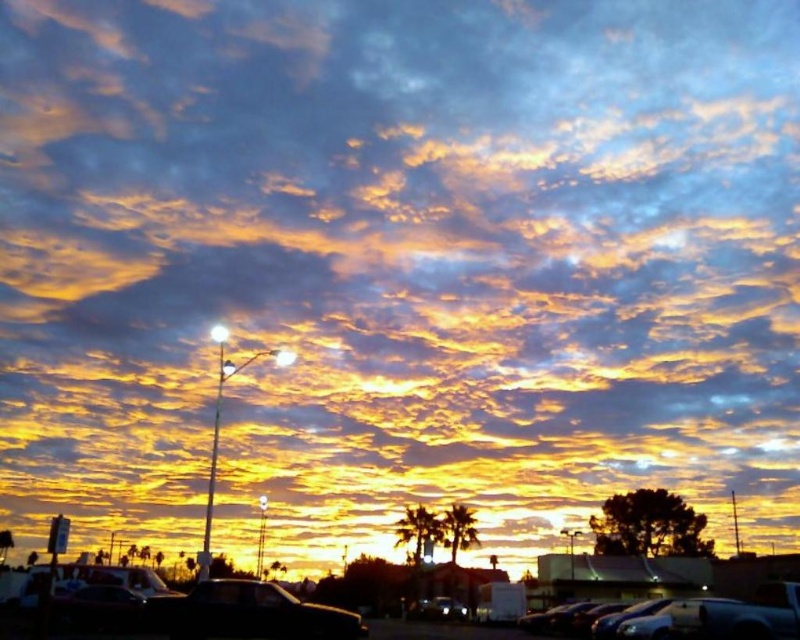
Can you confirm if black glossy car at lower center is positioned to the right of black asphalt parking lot at lower center?

Incorrect, black glossy car at lower center is not on the right side of black asphalt parking lot at lower center.

Measure the distance from black glossy car at lower center to black asphalt parking lot at lower center.

A distance of 33.51 feet exists between black glossy car at lower center and black asphalt parking lot at lower center.

Between point (176, 620) and point (8, 632), which one is positioned in front?

Point (176, 620) is more forward.

Find the location of a particular element. black glossy car at lower center is located at coordinates (249, 612).